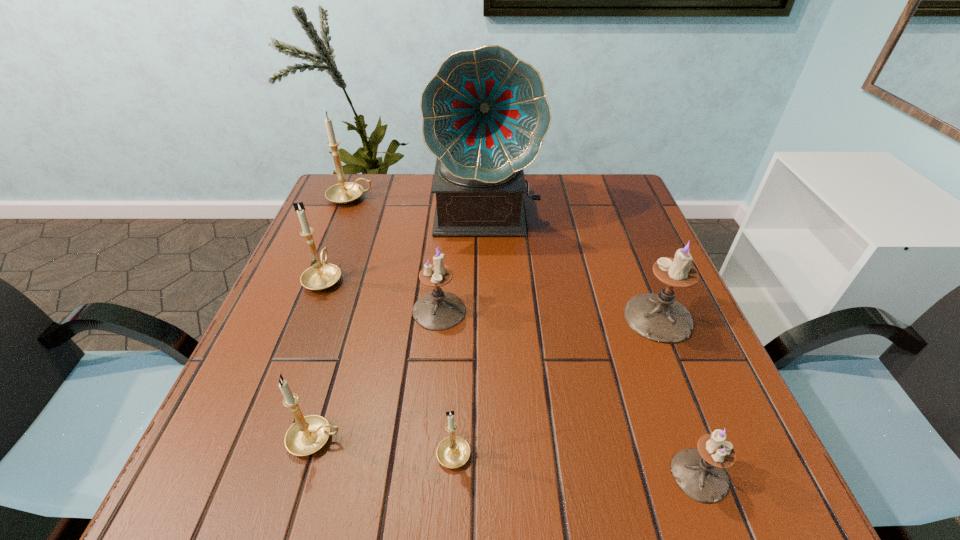
Image resolution: width=960 pixels, height=540 pixels. What are the coordinates of `vacant area situated 0.310m on the left of the smallest purple candle holder` in the screenshot? It's located at (469, 475).

At what (x,y) coordinates should I click in order to perform the action: click on record player that is at the far edge. Please return your answer as a coordinate pair (x, y). This screenshot has width=960, height=540. Looking at the image, I should click on (485, 114).

The image size is (960, 540). What are the coordinates of `candle holder at the far edge` in the screenshot? It's located at (345, 192).

I want to click on object located at the far left corner, so click(345, 192).

I want to click on object that is positioned at the near left corner, so click(307, 435).

The image size is (960, 540). I want to click on object that is at the near right corner, so click(x=699, y=473).

The width and height of the screenshot is (960, 540). I want to click on free region at the far edge of the desktop, so click(575, 200).

Find the location of `free spot at the near edge of the desktop`. free spot at the near edge of the desktop is located at coordinates (566, 507).

You are a GUI agent. You are given a task and a screenshot of the screen. Output one action in this format:
    pyautogui.click(x=<x>, y=<y>)
    Task: Click on the vacant space at the right edge of the desktop
    
    Given the screenshot: What is the action you would take?
    pyautogui.click(x=608, y=255)

This screenshot has height=540, width=960. What are the coordinates of `free space at the far left corner` in the screenshot? It's located at (378, 180).